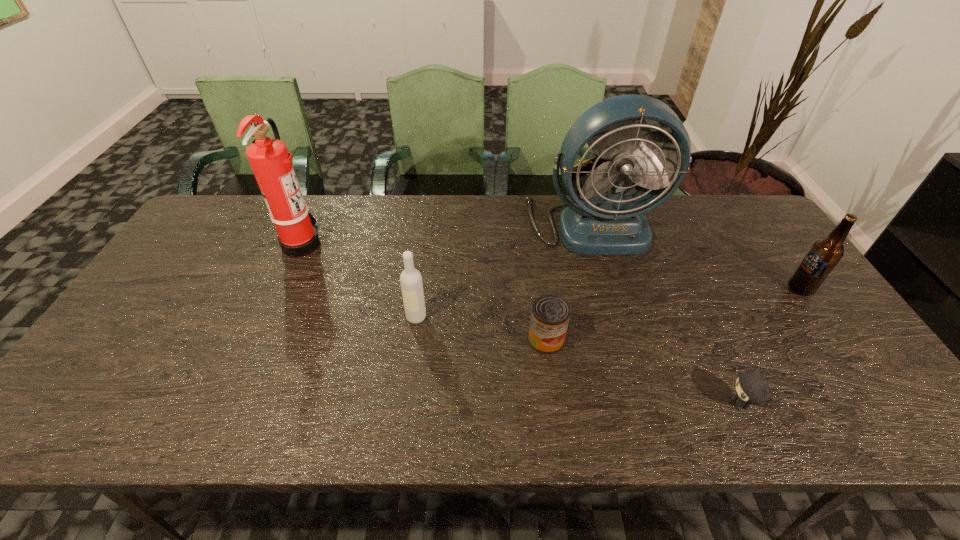
The width and height of the screenshot is (960, 540). In order to click on free spot that satisfies the following two spatial constraints: 1. at the nozzle of the fourth farthest object; 2. on the left side of the fire extinguisher in this screenshot , I will do `click(270, 317)`.

Locate an element on the screen. The image size is (960, 540). vacant space that satisfies the following two spatial constraints: 1. at the nozzle of the fifth farthest object; 2. on the left side of the leftmost object is located at coordinates (260, 340).

Find the location of `vacant space that satisfies the following two spatial constraints: 1. at the nozzle of the leftmost object; 2. on the right side of the second nearest object`. vacant space that satisfies the following two spatial constraints: 1. at the nozzle of the leftmost object; 2. on the right side of the second nearest object is located at coordinates (260, 340).

Where is `free point that satisfies the following two spatial constraints: 1. at the nozzle of the second nearest object; 2. on the right side of the fire extinguisher`? free point that satisfies the following two spatial constraints: 1. at the nozzle of the second nearest object; 2. on the right side of the fire extinguisher is located at coordinates (260, 340).